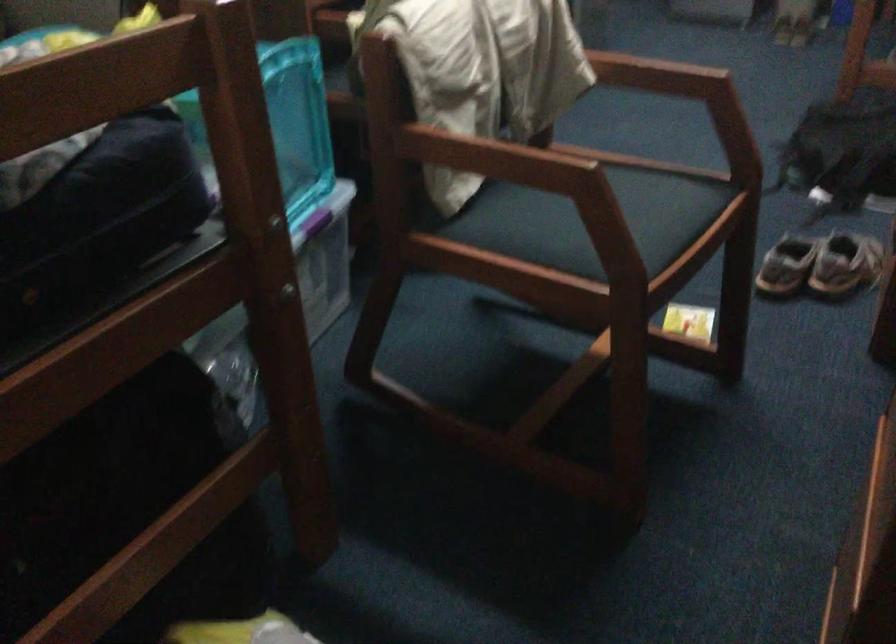
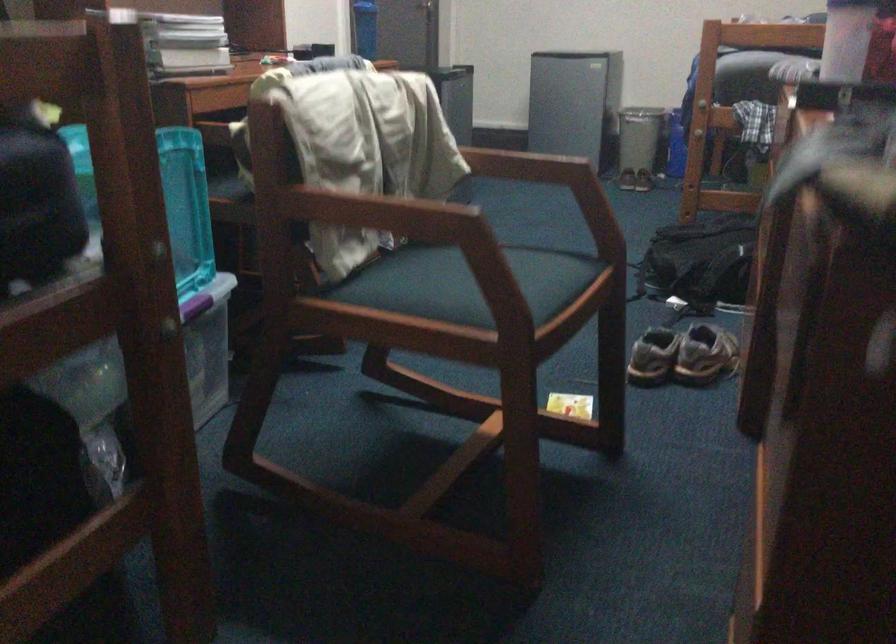
Locate, in the second image, the point that corresponds to (816,269) in the first image.

(682, 355)